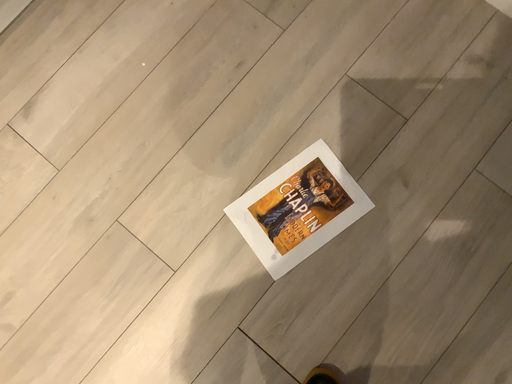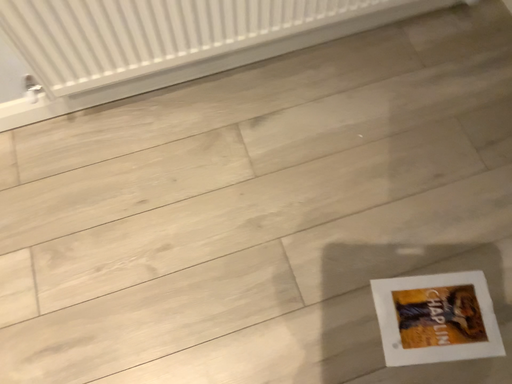
Question: How did the camera likely rotate when shooting the video?

Choices:
 (A) rotated upward
 (B) rotated downward

Answer: (A)